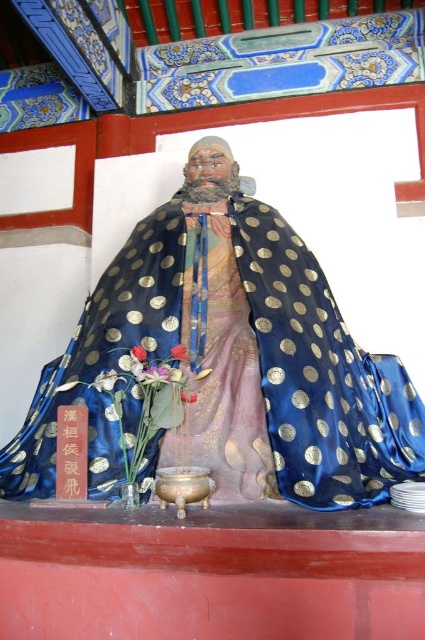
Can you confirm if blue satin cape at center is thinner than pink silk flower at center?

No.

Between point (34, 406) and point (141, 353), which one is positioned in front?

Point (141, 353) is more forward.

Is point (405, 404) closer to camera compared to point (136, 356)?

No, it is behind (136, 356).

You are a GUI agent. You are given a task and a screenshot of the screen. Output one action in this format:
    pyautogui.click(x=<x>, y=<y>)
    Task: Click on the blue satin cape at center
    Image resolution: width=425 pixels, height=640 pixels.
    Given the screenshot: What is the action you would take?
    pyautogui.click(x=320, y=376)

Who is positioned more to the right, blue satin cape at center or vivid pink petals at center?

blue satin cape at center is more to the right.

Does blue satin cape at center appear under vivid pink petals at center?

Actually, blue satin cape at center is above vivid pink petals at center.

What are the coordinates of `blue satin cape at center` in the screenshot? It's located at (320, 376).

I want to click on blue satin cape at center, so click(x=320, y=376).

Can you confirm if vivid pink petals at center is shorter than pink silk flower at center?

Yes, vivid pink petals at center is shorter than pink silk flower at center.

Measure the distance between point (186, 355) and camera.

The distance of point (186, 355) from camera is 28.80 feet.

This screenshot has width=425, height=640. In order to click on vivid pink petals at center in this screenshot , I will do `click(178, 353)`.